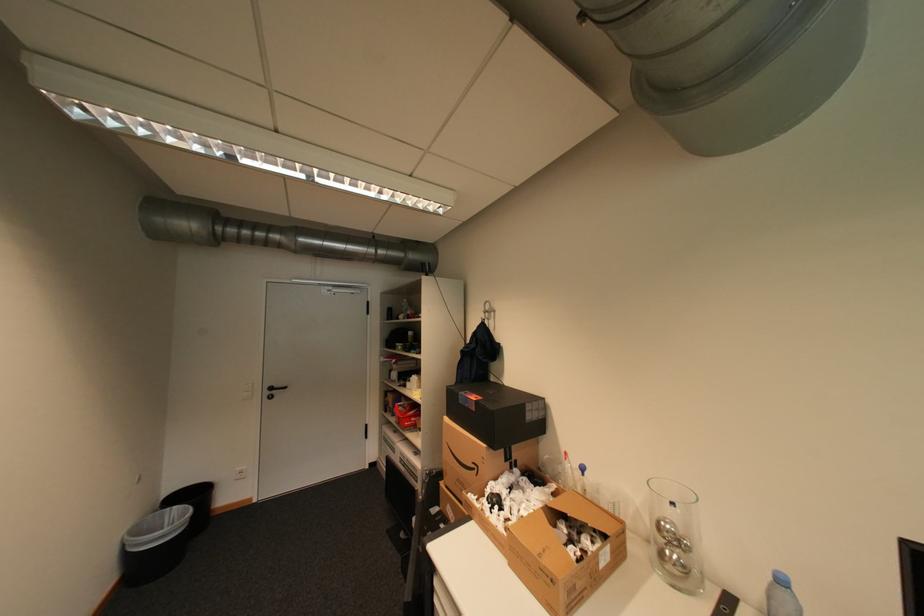
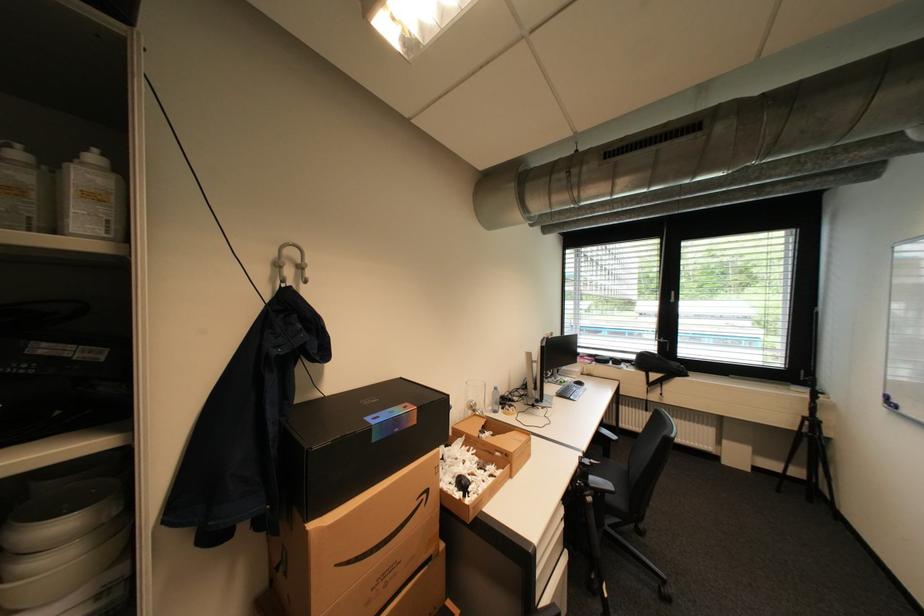
The point at [484,468] is marked in the first image. Where is the corresponding point in the second image?

(433, 496)